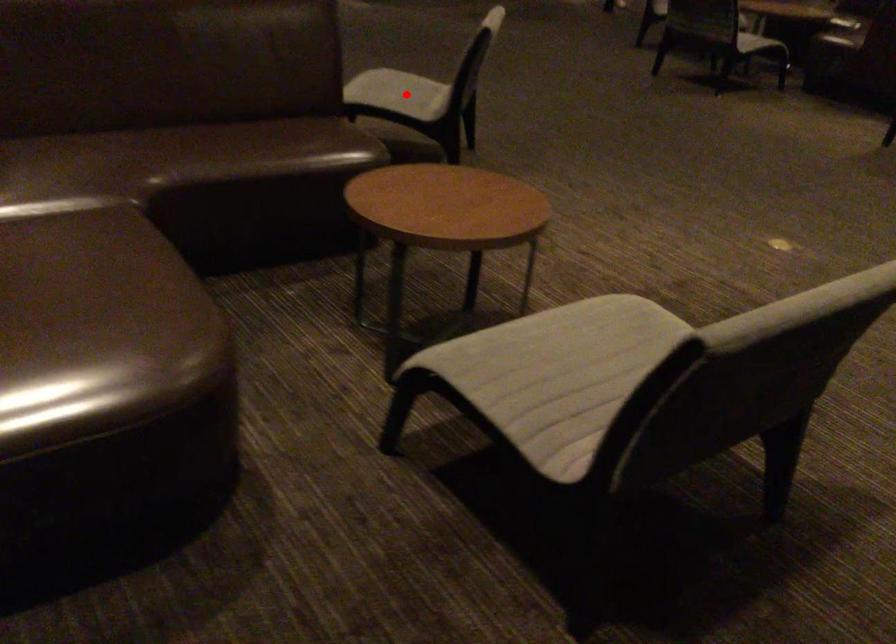
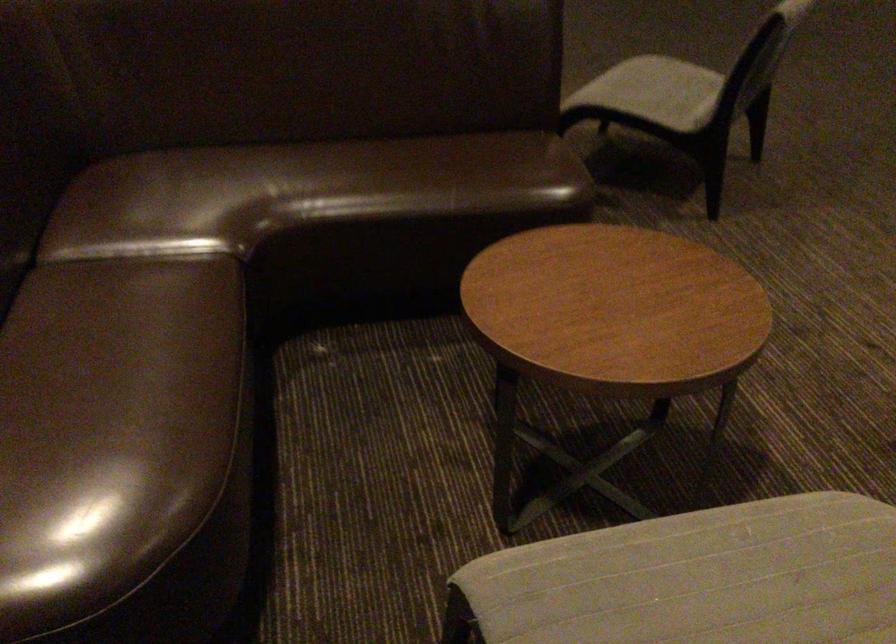
Where in the second image is the point corresponding to the highlighted location from the first image?

(655, 91)